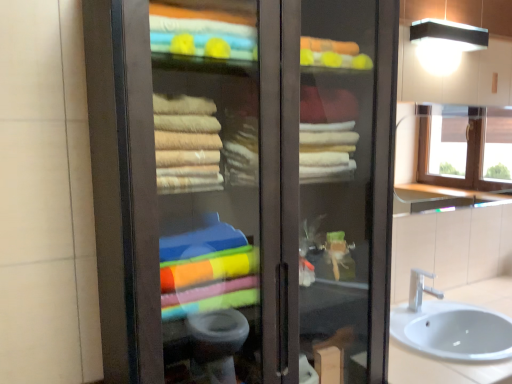
Question: Considering the relative sizes of clear glass window at upper right and silver metallic faucet at lower right in the image provided, is clear glass window at upper right taller than silver metallic faucet at lower right?

Choices:
 (A) yes
 (B) no

Answer: (A)

Question: Would you say clear glass window at upper right is outside silver metallic faucet at lower right?

Choices:
 (A) yes
 (B) no

Answer: (A)

Question: Is clear glass window at upper right thinner than silver metallic faucet at lower right?

Choices:
 (A) no
 (B) yes

Answer: (B)

Question: Is clear glass window at upper right looking in the opposite direction of silver metallic faucet at lower right?

Choices:
 (A) no
 (B) yes

Answer: (A)

Question: Considering the relative positions of clear glass window at upper right and silver metallic faucet at lower right in the image provided, is clear glass window at upper right in front of silver metallic faucet at lower right?

Choices:
 (A) no
 (B) yes

Answer: (A)

Question: Can you confirm if clear glass window at upper right is positioned to the left of silver metallic faucet at lower right?

Choices:
 (A) yes
 (B) no

Answer: (B)

Question: Is clear glass window at upper right taller than black matte light fixture at upper right?

Choices:
 (A) yes
 (B) no

Answer: (A)

Question: Does clear glass window at upper right turn towards black matte light fixture at upper right?

Choices:
 (A) yes
 (B) no

Answer: (B)

Question: Is clear glass window at upper right not close to black matte light fixture at upper right?

Choices:
 (A) yes
 (B) no

Answer: (A)

Question: From a real-world perspective, is clear glass window at upper right located higher than black matte light fixture at upper right?

Choices:
 (A) yes
 (B) no

Answer: (B)

Question: From the image's perspective, does clear glass window at upper right appear lower than black matte light fixture at upper right?

Choices:
 (A) yes
 (B) no

Answer: (A)

Question: Does clear glass window at upper right come in front of black matte light fixture at upper right?

Choices:
 (A) no
 (B) yes

Answer: (A)

Question: Is silver metallic faucet at lower right facing away from white ceramic sink at lower right?

Choices:
 (A) yes
 (B) no

Answer: (B)